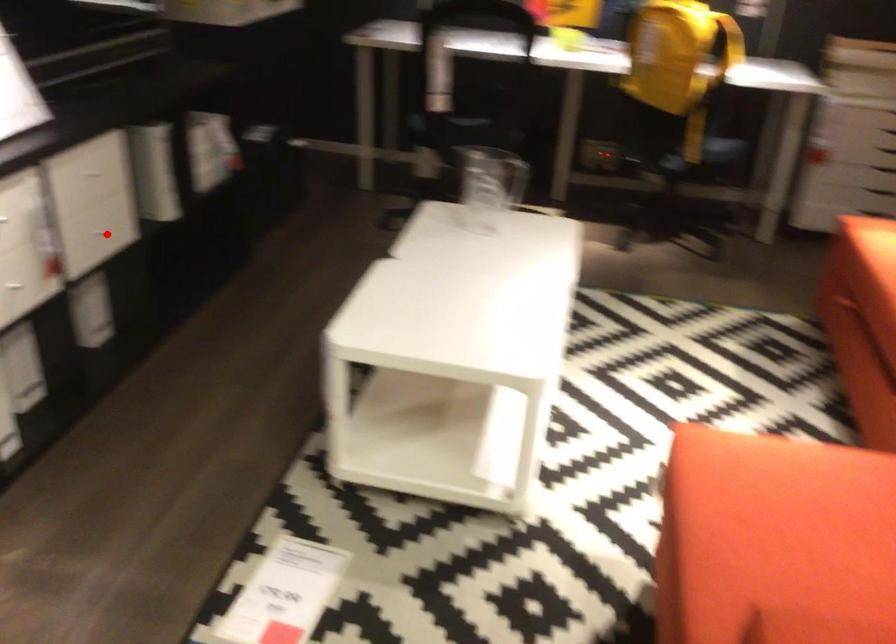
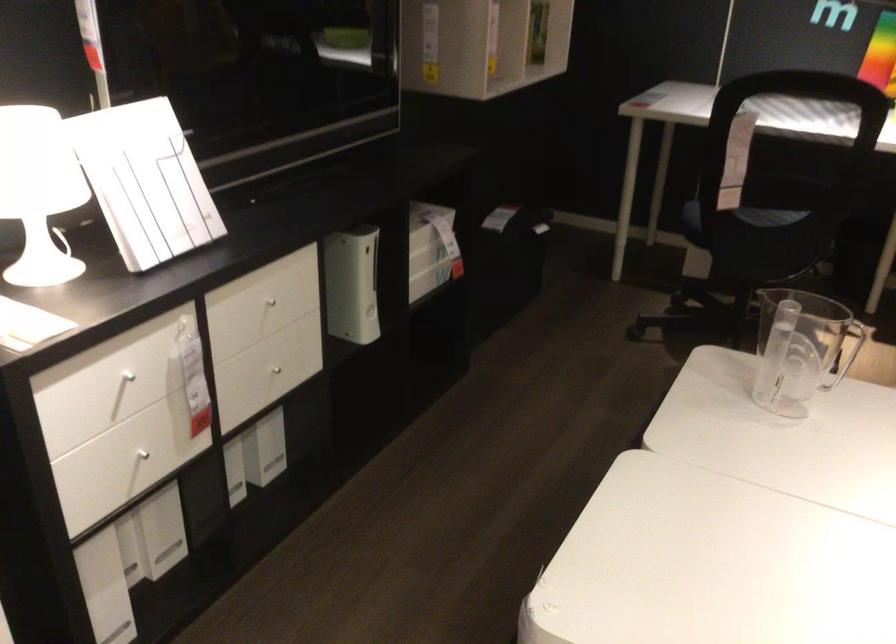
Locate, in the second image, the point that corresponds to the highlighted location in the first image.

(279, 366)